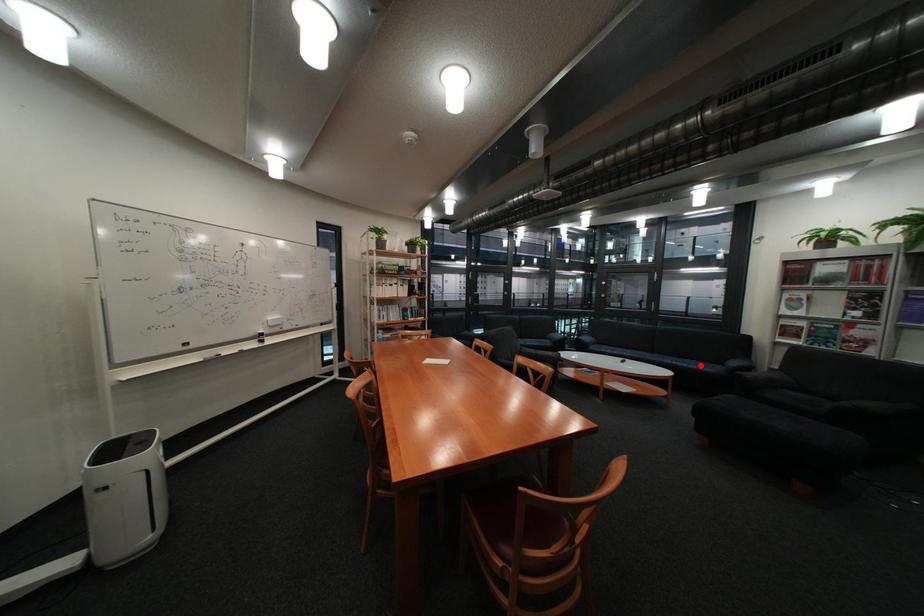
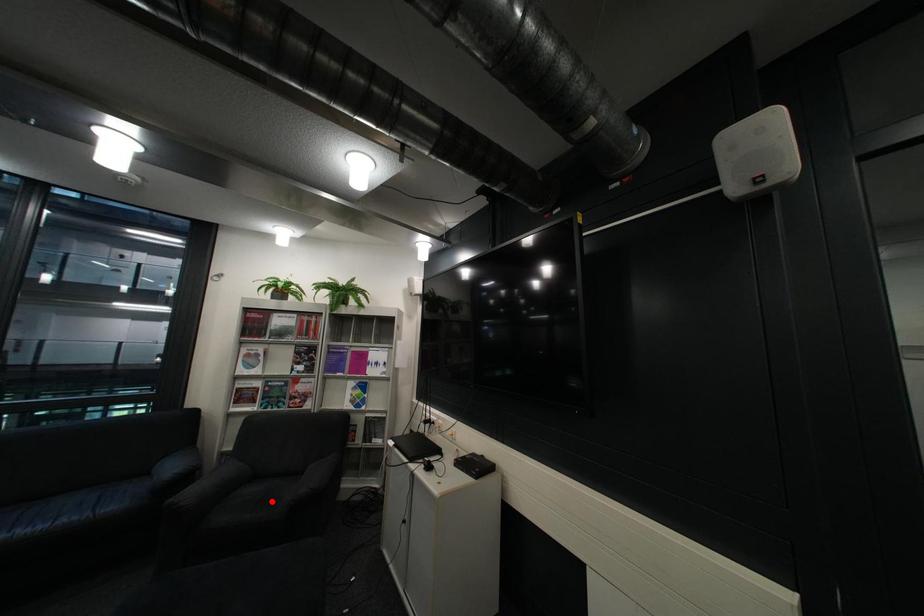
I am providing you with two images of the same scene from different viewpoints. A red point is marked on the first image and another point is marked on the second image. Do the highlighted points in image1 and image2 indicate the same real-world spot?

No